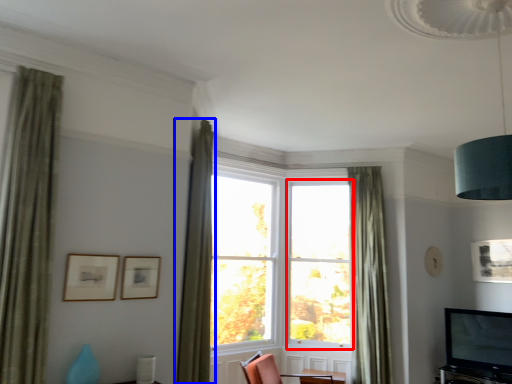
Question: Which object is closer to the camera taking this photo, window frame (highlighted by a red box) or curtain (highlighted by a blue box)?

Choices:
 (A) window frame
 (B) curtain

Answer: (B)